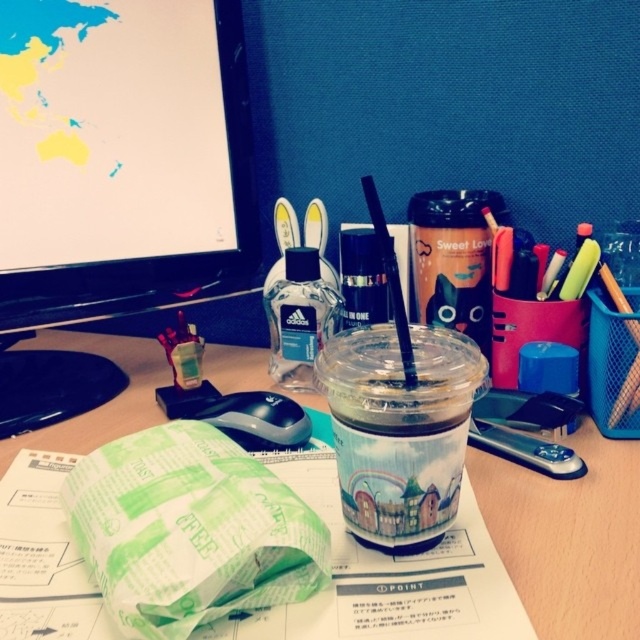
Question: Which object is closer to the camera taking this photo?

Choices:
 (A) matte black canister at center
 (B) black glossy computer monitor at upper center
 (C) translucent plastic bottle at center
 (D) black plastic mouse at lower center

Answer: (D)

Question: Can you confirm if black glossy computer monitor at upper center is smaller than translucent plastic bottle at center?

Choices:
 (A) no
 (B) yes

Answer: (A)

Question: Does matte black canister at center appear on the right side of black plastic mouse at lower center?

Choices:
 (A) yes
 (B) no

Answer: (A)

Question: Among these objects, which one is farthest from the camera?

Choices:
 (A) translucent plastic bottle at center
 (B) transparent plastic straw at center
 (C) wooden desk at center

Answer: (A)

Question: Which object appears closest to the camera in this image?

Choices:
 (A) translucent plastic bottle at center
 (B) black plastic mouse at lower center

Answer: (B)

Question: Is wooden desk at center smaller than translucent plastic bottle at center?

Choices:
 (A) yes
 (B) no

Answer: (B)